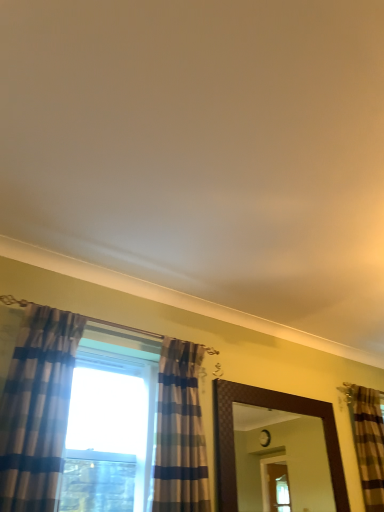
Question: From a real-world perspective, is brown striped curtain at right, the 1th curtain when ordered from right to left, physically located above or below striped fabric curtain at center, the 2th curtain viewed from the right?

Choices:
 (A) below
 (B) above

Answer: (B)

Question: Does point (379, 504) appear closer or farther from the camera than point (195, 449)?

Choices:
 (A) farther
 (B) closer

Answer: (A)

Question: Considering the real-world distances, which object is closest to the plaid fabric curtain at left, placed as the third curtain when sorted from right to left?

Choices:
 (A) striped fabric curtain at center, placed as the 2th curtain when sorted from front to back
 (B) brown textured mirror at center
 (C) brown striped curtain at right, which appears as the third curtain when viewed from the front

Answer: (A)

Question: Which of these objects is positioned closest to the brown textured mirror at center?

Choices:
 (A) plaid fabric curtain at left, placed as the first curtain when sorted from front to back
 (B) brown striped curtain at right, the 1th curtain in the back-to-front sequence
 (C) striped fabric curtain at center, placed as the 2th curtain when sorted from front to back

Answer: (B)